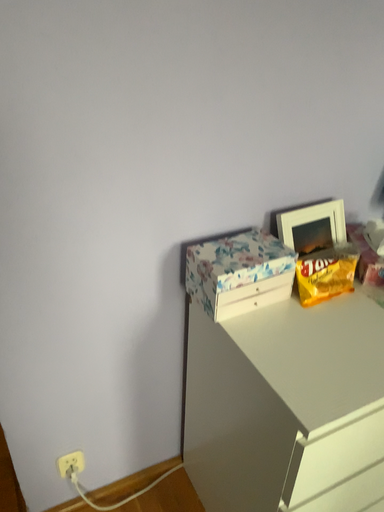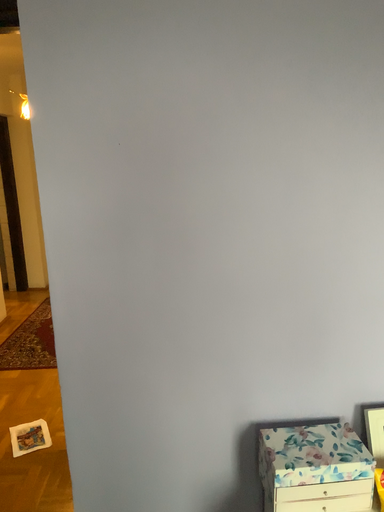
Question: How did the camera likely rotate when shooting the video?

Choices:
 (A) rotated right
 (B) rotated left

Answer: (B)